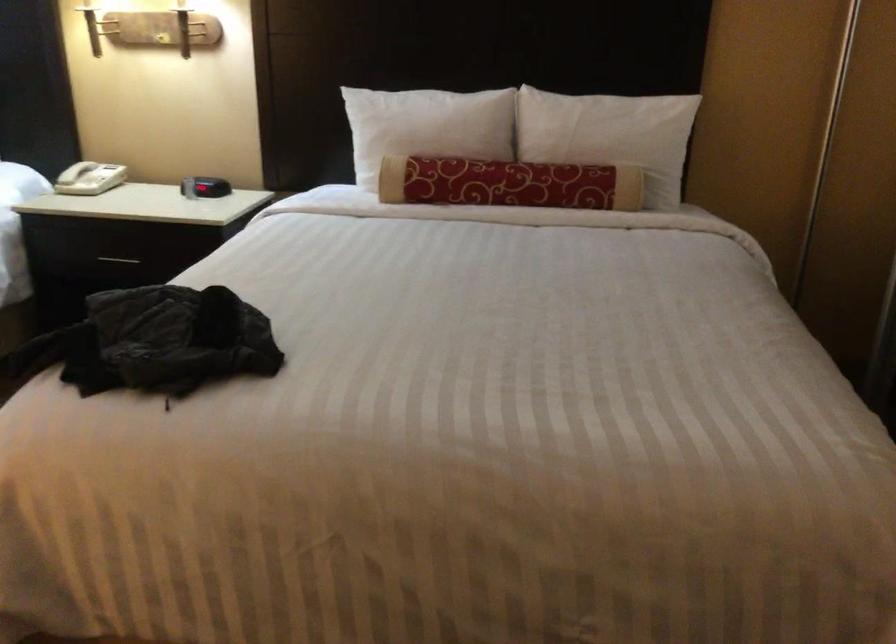
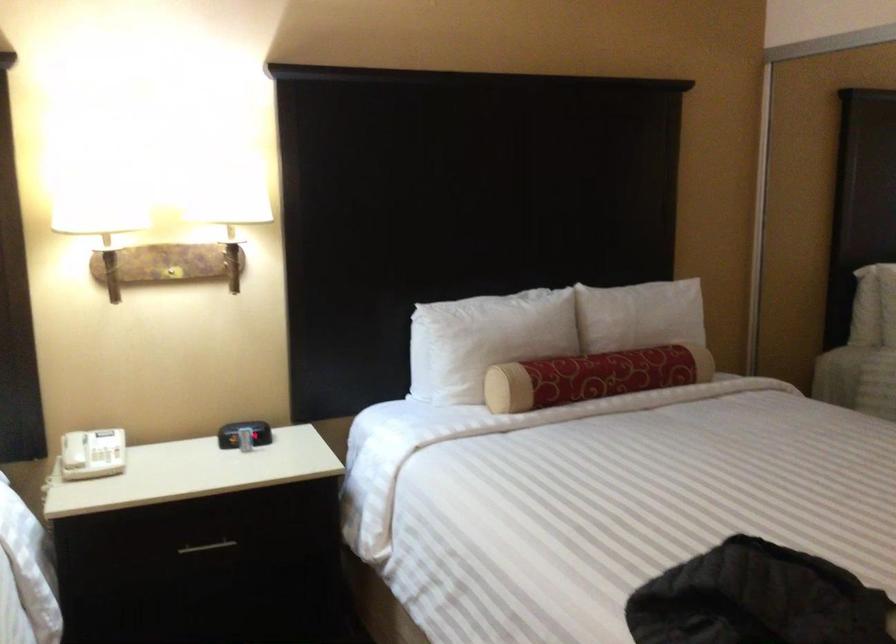
In the second image, find the point that corresponds to point 185,180 in the first image.

(244, 433)